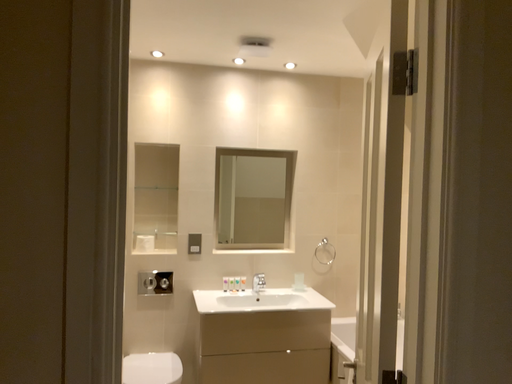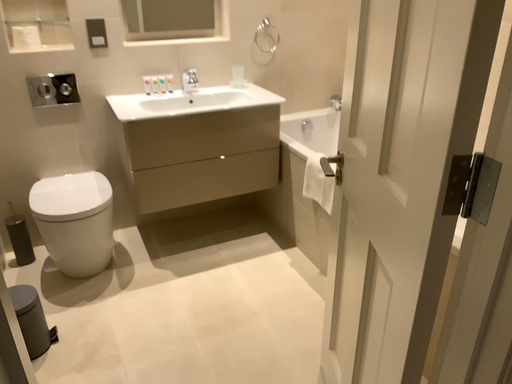
Question: How did the camera likely rotate when shooting the video?

Choices:
 (A) rotated left
 (B) rotated right

Answer: (B)